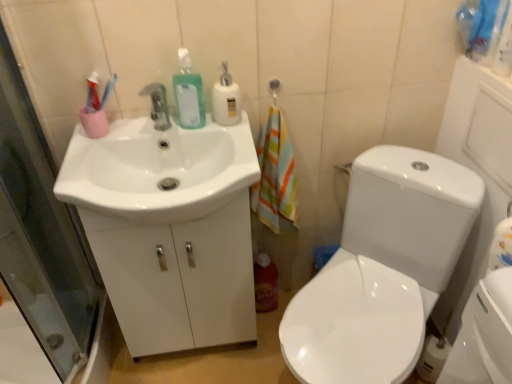
Describe the element at coordinates (265, 284) in the screenshot. I see `translucent plastic bottle at lower center, placed as the third cleaning product when sorted from front to back` at that location.

The image size is (512, 384). I want to click on white glossy soap dispenser at upper center, acting as the 2th cleaning product starting from the top, so click(226, 99).

This screenshot has width=512, height=384. In order to click on white glossy toilet at right in this screenshot , I will do `click(382, 269)`.

You are a GUI agent. You are given a task and a screenshot of the screen. Output one action in this format:
    pyautogui.click(x=<x>, y=<y>)
    Task: Click on the white glossy toilet at right
    The width and height of the screenshot is (512, 384).
    Given the screenshot: What is the action you would take?
    pyautogui.click(x=483, y=200)

From a real-world perspective, relative to translucent plastic bottle at lower center, which is counted as the first cleaning product, starting from the right, is white glossy soap dispenser at upper center, the 2th cleaning product positioned from the bottom, vertically above or below?

white glossy soap dispenser at upper center, the 2th cleaning product positioned from the bottom, is above translucent plastic bottle at lower center, which is counted as the first cleaning product, starting from the right.

Could you tell me if white glossy soap dispenser at upper center, the 2th cleaning product positioned from the bottom, is turned towards translucent plastic bottle at lower center, acting as the first cleaning product starting from the bottom?

No, white glossy soap dispenser at upper center, the 2th cleaning product positioned from the bottom, is not oriented towards translucent plastic bottle at lower center, acting as the first cleaning product starting from the bottom.

What's the angular difference between white glossy soap dispenser at upper center, the second cleaning product when ordered from left to right, and translucent plastic bottle at lower center, placed as the third cleaning product when sorted from front to back,'s facing directions?

0.571 degrees separate the facing orientations of white glossy soap dispenser at upper center, the second cleaning product when ordered from left to right, and translucent plastic bottle at lower center, placed as the third cleaning product when sorted from front to back.

Which of these two, white glossy soap dispenser at upper center, the 2th cleaning product positioned from the bottom, or translucent plastic bottle at lower center, placed as the third cleaning product when sorted from front to back, stands taller?

Standing taller between the two is translucent plastic bottle at lower center, placed as the third cleaning product when sorted from front to back.

Does translucent plastic bottle at lower center, marked as the 1th cleaning product in a back-to-front arrangement, turn towards white glossy sink at left?

No, translucent plastic bottle at lower center, marked as the 1th cleaning product in a back-to-front arrangement, is not facing towards white glossy sink at left.

From the image's perspective, between translucent plastic bottle at lower center, marked as the 3th cleaning product in a top-to-bottom arrangement, and white glossy sink at left, which one is located above?

white glossy sink at left, from the image's perspective.

Would you say translucent plastic bottle at lower center, placed as the third cleaning product when sorted from front to back, is to the left or to the right of white glossy sink at left in the picture?

Clearly, translucent plastic bottle at lower center, placed as the third cleaning product when sorted from front to back, is on the right of white glossy sink at left in the image.

Between translucent plastic bottle at lower center, which is counted as the first cleaning product, starting from the right, and white glossy sink at left, which one has more height?

translucent plastic bottle at lower center, which is counted as the first cleaning product, starting from the right, is taller.

Does matte silver faucet at center have a greater width compared to white glossy toilet at right?

Incorrect, the width of matte silver faucet at center does not surpass that of white glossy toilet at right.

Based on the photo, considering the sizes of matte silver faucet at center and white glossy toilet at right in the image, is matte silver faucet at center bigger or smaller than white glossy toilet at right?

matte silver faucet at center is smaller than white glossy toilet at right.

Would you say white glossy toilet at right is part of matte silver faucet at center's contents?

No.

In the scene shown: From a real-world perspective, is matte silver faucet at center over white glossy toilet at right?

Yes, from a real-world perspective, matte silver faucet at center is over white glossy toilet at right

Would you consider white glossy toilet at right to be distant from matte silver faucet at center?

No, white glossy toilet at right is in close proximity to matte silver faucet at center.

Does white glossy toilet at right contain matte silver faucet at center?

Actually, matte silver faucet at center is outside white glossy toilet at right.

Is point (476, 96) behind point (161, 84)?

Yes, it is behind point (161, 84).

Between white glossy toilet at right and matte silver faucet at center, which one has more height?

Standing taller between the two is white glossy toilet at right.

From the picture: Who is bigger, white glossy sink at left or green matte liquid soap at upper center, which is the first cleaning product from front to back?

With larger size is white glossy sink at left.

Is white glossy sink at left oriented away from green matte liquid soap at upper center, arranged as the 3th cleaning product when viewed from the back?

No, white glossy sink at left is not facing away from green matte liquid soap at upper center, arranged as the 3th cleaning product when viewed from the back.

Considering the relative positions of white glossy sink at left and green matte liquid soap at upper center, which is the first cleaning product from front to back, in the image provided, is white glossy sink at left in front of green matte liquid soap at upper center, which is the first cleaning product from front to back,?

Yes, white glossy sink at left is closer to the camera.

Which is behind, white glossy toilet at right or white glossy toilet at right?

Positioned behind is white glossy toilet at right.

From the image's perspective, is white glossy toilet at right located beneath white glossy toilet at right?

Yes, from the image's perspective, white glossy toilet at right is below white glossy toilet at right.

Considering the points (405, 345) and (477, 274), which point is in front, point (405, 345) or point (477, 274)?

The point (405, 345) is closer.

Between white glossy toilet at right and white glossy toilet at right, which one has more height?

white glossy toilet at right.

From the image's perspective, does green matte liquid soap at upper center, arranged as the 3th cleaning product when viewed from the back, appear higher than matte silver faucet at center?

Indeed, from the image's perspective, green matte liquid soap at upper center, arranged as the 3th cleaning product when viewed from the back, is shown above matte silver faucet at center.

Can you confirm if green matte liquid soap at upper center, arranged as the 3th cleaning product when viewed from the back, is positioned to the left of matte silver faucet at center?

In fact, green matte liquid soap at upper center, arranged as the 3th cleaning product when viewed from the back, is to the right of matte silver faucet at center.

Is green matte liquid soap at upper center, the first cleaning product positioned from the top, outside of matte silver faucet at center?

Yes, green matte liquid soap at upper center, the first cleaning product positioned from the top, is outside of matte silver faucet at center.

From the picture: Can you confirm if green matte liquid soap at upper center, the 1th cleaning product positioned from the left, is thinner than matte silver faucet at center?

Correct, the width of green matte liquid soap at upper center, the 1th cleaning product positioned from the left, is less than that of matte silver faucet at center.

Where is `cleaning product that is the 1st one when counting forward from the translucent plastic bottle at lower center, acting as the first cleaning product starting from the bottom`? Image resolution: width=512 pixels, height=384 pixels. cleaning product that is the 1st one when counting forward from the translucent plastic bottle at lower center, acting as the first cleaning product starting from the bottom is located at coordinates (226, 99).

Where is `sink that is above the translucent plastic bottle at lower center, the third cleaning product positioned from the left (from a real-world perspective)`? The height and width of the screenshot is (384, 512). sink that is above the translucent plastic bottle at lower center, the third cleaning product positioned from the left (from a real-world perspective) is located at coordinates (158, 170).

From the image, which object appears to be nearer to green matte liquid soap at upper center, the first cleaning product positioned from the top, white glossy toilet at right or white glossy cabinet at left?

white glossy cabinet at left is positioned closer to the anchor green matte liquid soap at upper center, the first cleaning product positioned from the top.

When comparing their distances from translucent plastic bottle at lower center, the third cleaning product positioned from the left, does white glossy soap dispenser at upper center, which ranks as the second cleaning product in back-to-front order, or matte silver faucet at center seem closer?

white glossy soap dispenser at upper center, which ranks as the second cleaning product in back-to-front order, is closer to translucent plastic bottle at lower center, the third cleaning product positioned from the left.

When comparing their distances from white glossy toilet at right, does matte silver faucet at center or green matte liquid soap at upper center, the third cleaning product in the right-to-left sequence, seem further?

matte silver faucet at center lies further to white glossy toilet at right than the other object.

When comparing their distances from white glossy toilet at right, does green matte liquid soap at upper center, the third cleaning product in the right-to-left sequence, or white glossy soap dispenser at upper center, acting as the 2th cleaning product starting from the top, seem closer?

Based on the image, white glossy soap dispenser at upper center, acting as the 2th cleaning product starting from the top, appears to be nearer to white glossy toilet at right.

When comparing their distances from matte silver faucet at center, does white glossy soap dispenser at upper center, the 2th cleaning product positioned from the bottom, or white glossy toilet at right seem further?

Among the two, white glossy toilet at right is located further to matte silver faucet at center.

Considering their positions, is white glossy toilet at right positioned further to white glossy cabinet at left than white glossy sink at left?

The object further to white glossy cabinet at left is white glossy toilet at right.

Which object lies further to the anchor point white glossy soap dispenser at upper center, positioned as the 2th cleaning product in front-to-back order, translucent plastic bottle at lower center, the third cleaning product positioned from the left, or green matte liquid soap at upper center, which is the first cleaning product from front to back?

Based on the image, translucent plastic bottle at lower center, the third cleaning product positioned from the left, appears to be further to white glossy soap dispenser at upper center, positioned as the 2th cleaning product in front-to-back order.

Looking at the image, which one is located further to green matte liquid soap at upper center, which is the first cleaning product from front to back, matte silver faucet at center or translucent plastic bottle at lower center, which is counted as the first cleaning product, starting from the right?

translucent plastic bottle at lower center, which is counted as the first cleaning product, starting from the right.

The width and height of the screenshot is (512, 384). Find the location of `toilet situated between matte silver faucet at center and white glossy toilet at right from left to right`. toilet situated between matte silver faucet at center and white glossy toilet at right from left to right is located at coordinates (382, 269).

This screenshot has width=512, height=384. I want to click on sink between green matte liquid soap at upper center, the third cleaning product in the bottom-to-top sequence, and white glossy cabinet at left from top to bottom, so click(158, 170).

In order to click on toilet located between green matte liquid soap at upper center, the third cleaning product in the bottom-to-top sequence, and white glossy toilet at right in the left-right direction in this screenshot , I will do `click(382, 269)`.

You are a GUI agent. You are given a task and a screenshot of the screen. Output one action in this format:
    pyautogui.click(x=<x>, y=<y>)
    Task: Click on the tap that lies between white glossy soap dispenser at upper center, positioned as the 2th cleaning product in right-to-left order, and translucent plastic bottle at lower center, acting as the first cleaning product starting from the bottom, from top to bottom
    
    Given the screenshot: What is the action you would take?
    pyautogui.click(x=157, y=105)